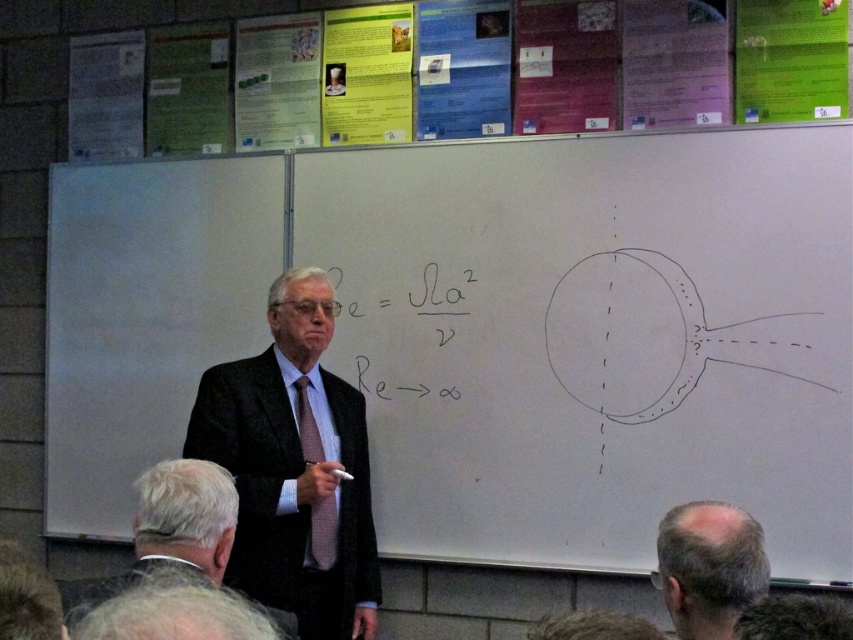
Question: Considering the relative positions of dark suit at center and bald head at lower right in the image provided, where is dark suit at center located with respect to bald head at lower right?

Choices:
 (A) left
 (B) right

Answer: (A)

Question: Among these objects, which one is farthest from the camera?

Choices:
 (A) white textured hair at lower left
 (B) black matte equation at center
 (C) bald head at lower right
 (D) dotted silk tie at center

Answer: (B)

Question: Is the position of bald head at lower right more distant than that of dotted silk tie at center?

Choices:
 (A) no
 (B) yes

Answer: (A)

Question: Considering the relative positions of whiteboard at upper center and white textured hair at lower left in the image provided, where is whiteboard at upper center located with respect to white textured hair at lower left?

Choices:
 (A) right
 (B) left

Answer: (A)

Question: Which point is closer to the camera?

Choices:
 (A) (167, 467)
 (B) (397, 188)
 (C) (660, 563)

Answer: (C)

Question: Which point is farther from the camera taking this photo?

Choices:
 (A) (135, 492)
 (B) (343, 609)
 (C) (422, 323)
 (D) (305, 426)

Answer: (A)